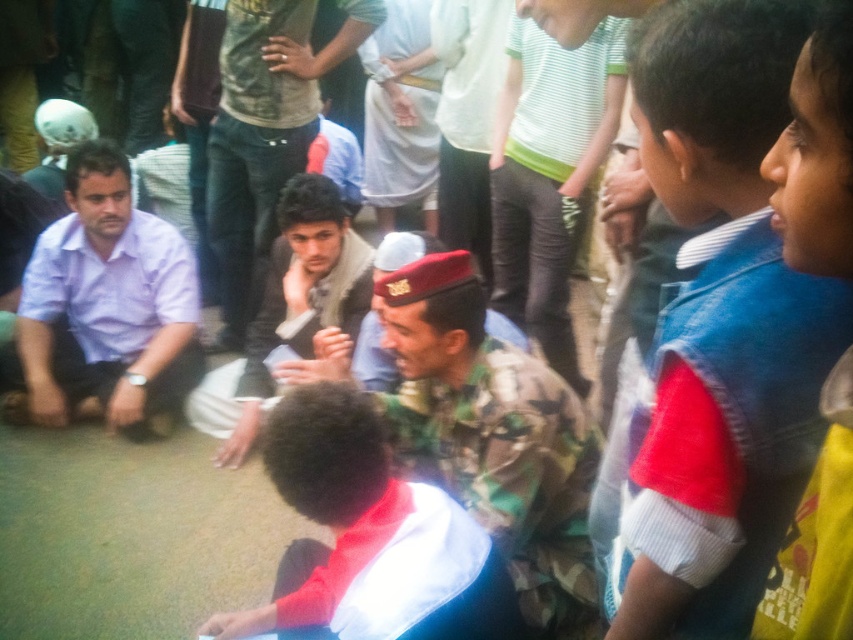
Question: Is matte purple shirt at left thinner than striped cotton shirt at center?

Choices:
 (A) no
 (B) yes

Answer: (A)

Question: Does matte purple shirt at left lie behind striped cotton shirt at center?

Choices:
 (A) yes
 (B) no

Answer: (A)

Question: Which object is positioned farthest from the dark gray jacket at center?

Choices:
 (A) matte purple shirt at left
 (B) camouflage uniform at center

Answer: (A)

Question: Is white fabric shirt at center to the left of dark gray jacket at center from the viewer's perspective?

Choices:
 (A) yes
 (B) no

Answer: (B)

Question: Which point is closer to the camera taking this photo?

Choices:
 (A) (479, 612)
 (B) (805, 330)

Answer: (B)

Question: Which point is farther to the camera?

Choices:
 (A) striped cotton shirt at center
 (B) white fabric shirt at center

Answer: (A)